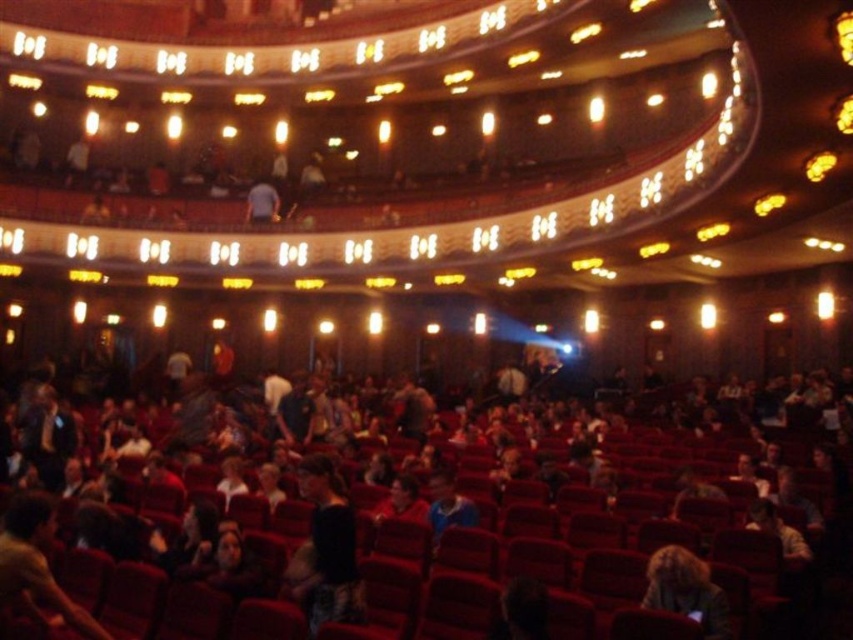
You are a stagehand preparing to move a 12 meter long equipment cart from the dark brown leather jacket at center to the blonde hair at lower right. Can you move it without any obstruction?

The distance between the dark brown leather jacket at center and the blonde hair at lower right is 12.20 meters, so the 12 meter long equipment cart can be moved between them without any obstruction as there is enough space.

Consider the image. You are sitting in the theater and want to determine which of the two points, point (317, 593) or point (697, 573), is closer to you. Based on the scene description, which point is nearer?

Point (317, 593) is further to the viewer than point (697, 573). Wait, no, the description says the opposite. Let me check again. The Objects Description states that point (317, 593) is further to the viewer than point (697, 573). Therefore, the point that is nearer to you would be point (697, 573) because it is closer to the viewer compared to the other point.